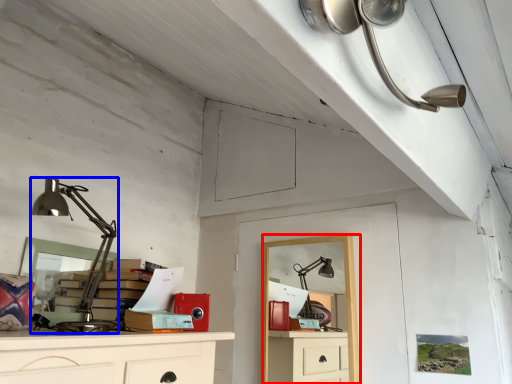
Question: Which object is closer to the camera taking this photo, computer desk (highlighted by a red box) or lamp (highlighted by a blue box)?

Choices:
 (A) computer desk
 (B) lamp

Answer: (B)